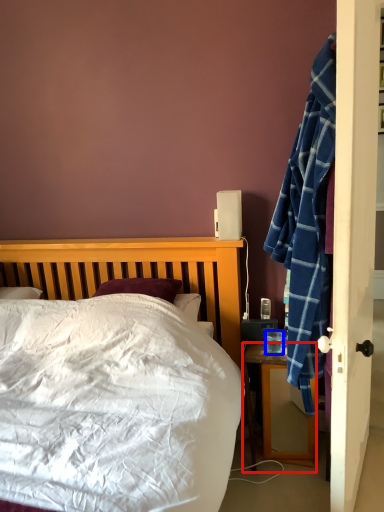
Question: Among these objects, which one is nearest to the camera, desk (highlighted by a red box) or coffee cup (highlighted by a blue box)?

Choices:
 (A) desk
 (B) coffee cup

Answer: (A)